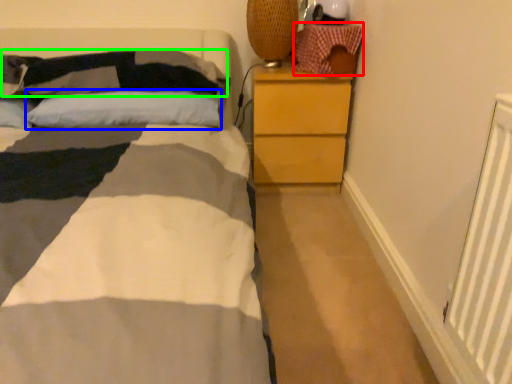
Question: Which is nearer to the material (highlighted by a red box)? pillow (highlighted by a blue box) or pillow (highlighted by a green box).

Choices:
 (A) pillow
 (B) pillow

Answer: (A)